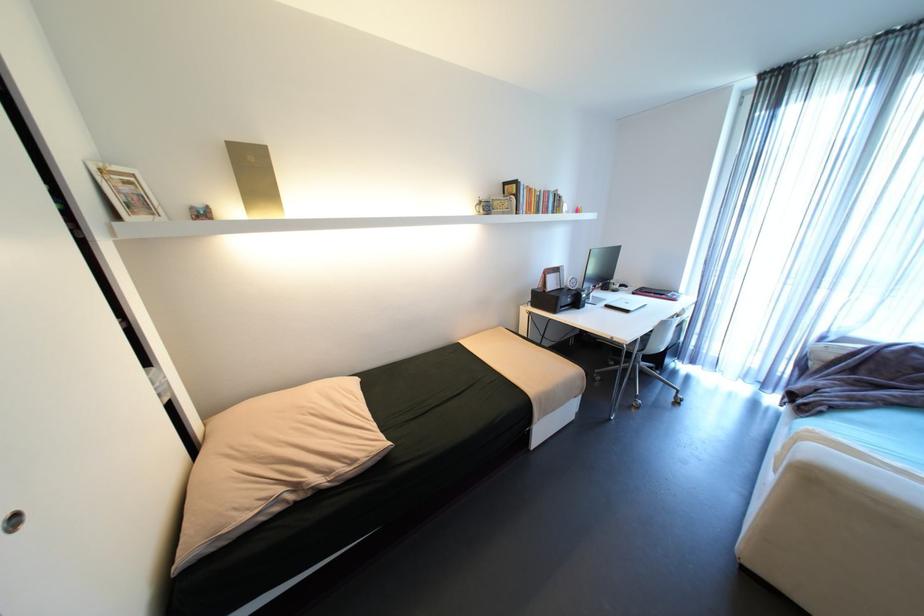
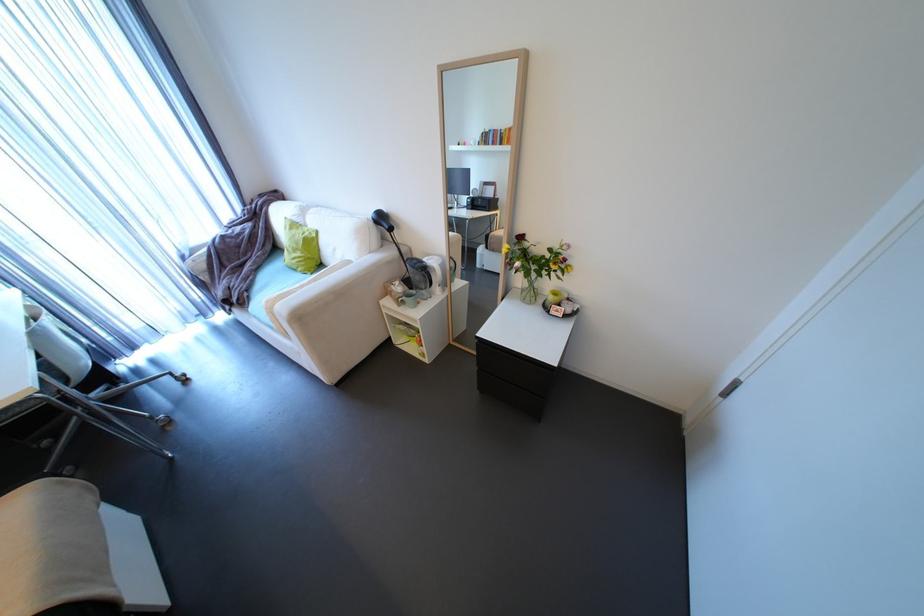
The point at (839,339) is marked in the first image. Where is the corresponding point in the second image?

(195, 254)